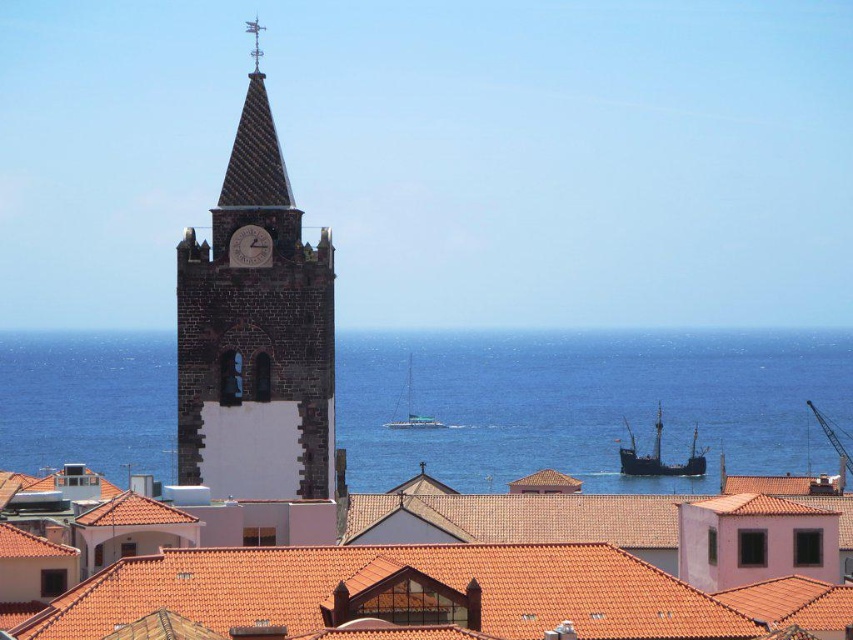
You are standing at the base of the dark stone tower and want to locate two points marked in the image. Which of the two points, point [271,490] or point [416,412], is closer to you?

Point [271,490] is closer to you because it is in front of point [416,412].

You are a tourist standing in the coastal town and want to take a photo that includes both the blue water at center and the matte stone clock at upper center. Which object should you position closer to the edge of your camera frame to ensure both fit in the shot?

Since the blue water at center is bigger than the matte stone clock at upper center, you should position the larger blue water at center closer to the edge of your camera frame to ensure both fit in the shot.

You are standing at the viewpoint in the coastal town scene. You notice two points marked in the image. From your perspective, which point is closer to you? The points are labeled as point 1 at coordinates point (343, 342) and point 2 at coordinates point (260, 237). Please identify the closer one based on their positions in the scene.

Point 2 at coordinates point (260, 237) is closer to you because it is in front of point 1 at coordinates point (343, 342) according to their spatial arrangement in the scene.